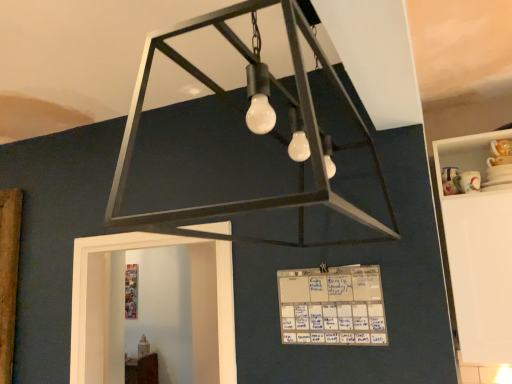
Question: Based on their positions, is matte black chandelier at center located to the left or right of white glossy cabinet at right?

Choices:
 (A) right
 (B) left

Answer: (B)

Question: Looking at the image, does matte black chandelier at center seem bigger or smaller compared to white glossy cabinet at right?

Choices:
 (A) small
 (B) big

Answer: (B)

Question: Considering the real-world distances, which object is closest to the white glossy cabinet at right?

Choices:
 (A) white paper calendar at center
 (B) matte black chandelier at center

Answer: (A)

Question: Which is farther from the white paper calendar at center?

Choices:
 (A) matte black chandelier at center
 (B) white glossy cabinet at right

Answer: (B)